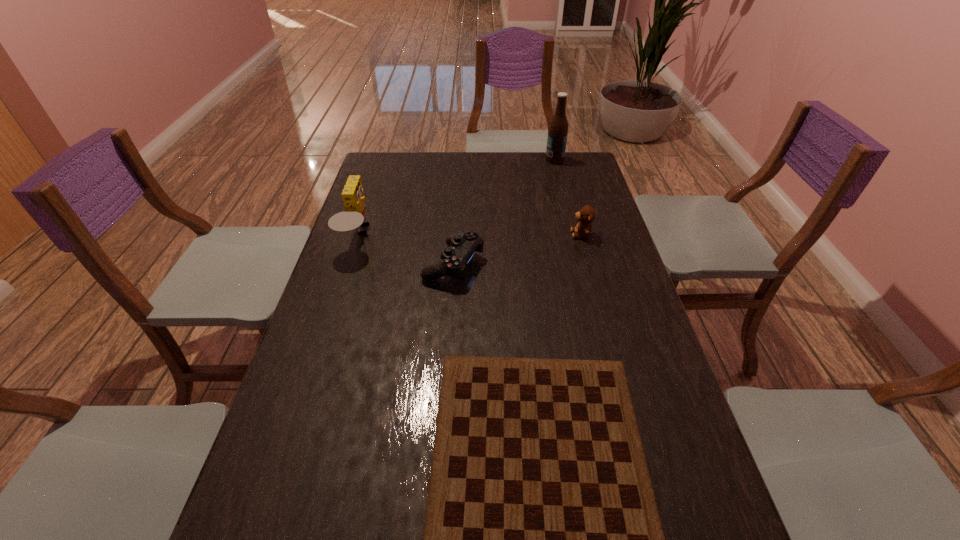
Identify the location of the third closest object relative to the shortest object. The width and height of the screenshot is (960, 540). (586, 215).

Identify which object is the second closest to the tallest object. Please provide its 2D coordinates. Your answer should be formatted as a tuple, i.e. [(x, y)], where the tuple contains the x and y coordinates of a point satisfying the conditions above.

[(454, 259)]

What are the coordinates of `blank area in the image that satisfies the following two spatial constraints: 1. on the front-facing side of the fourth tallest object; 2. on the right side of the sponge` in the screenshot? It's located at (349, 264).

I want to click on vacant space that satisfies the following two spatial constraints: 1. on the front-facing side of the second tallest object; 2. on the back side of the control, so click(349, 264).

I want to click on free space that satisfies the following two spatial constraints: 1. on the front-facing side of the second tallest object; 2. on the left side of the second shortest object, so click(x=349, y=264).

You are a GUI agent. You are given a task and a screenshot of the screen. Output one action in this format:
    pyautogui.click(x=<x>, y=<y>)
    Task: Click on the vacant space that satisfies the following two spatial constraints: 1. on the front-facing side of the second tallest object; 2. on the right side of the control
    Image resolution: width=960 pixels, height=540 pixels.
    Given the screenshot: What is the action you would take?
    pyautogui.click(x=349, y=264)